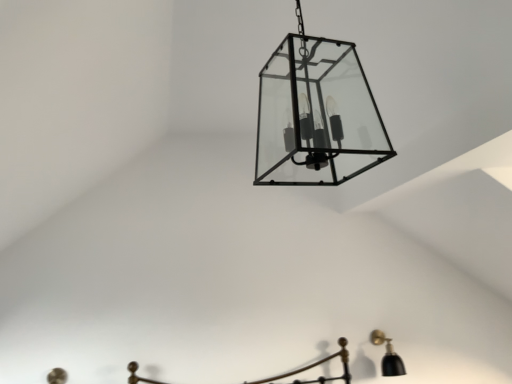
Question: Is clear glass lantern at center, acting as the first lamp starting from the front, situated inside black matte wall sconce at lower right, the second lamp viewed from the left, or outside?

Choices:
 (A) inside
 (B) outside

Answer: (B)

Question: From a real-world perspective, is clear glass lantern at center, which is counted as the 1th lamp, starting from the top, above or below black matte wall sconce at lower right, which is the first lamp in back-to-front order?

Choices:
 (A) above
 (B) below

Answer: (A)

Question: Is clear glass lantern at center, the second lamp when ordered from right to left, taller or shorter than black matte wall sconce at lower right, the 2th lamp from the top?

Choices:
 (A) tall
 (B) short

Answer: (A)

Question: In terms of size, does black matte wall sconce at lower right, the second lamp viewed from the left, appear bigger or smaller than clear glass lantern at center, the first lamp positioned from the left?

Choices:
 (A) big
 (B) small

Answer: (B)

Question: Based on their positions, is black matte wall sconce at lower right, the second lamp viewed from the front, located to the left or right of clear glass lantern at center, the 2th lamp in the back-to-front sequence?

Choices:
 (A) right
 (B) left

Answer: (A)

Question: Do you think black matte wall sconce at lower right, placed as the first lamp when sorted from right to left, is within clear glass lantern at center, the first lamp positioned from the left, or outside of it?

Choices:
 (A) inside
 (B) outside

Answer: (B)

Question: From their relative heights in the image, would you say black matte wall sconce at lower right, the second lamp viewed from the front, is taller or shorter than clear glass lantern at center, the first lamp positioned from the left?

Choices:
 (A) short
 (B) tall

Answer: (A)